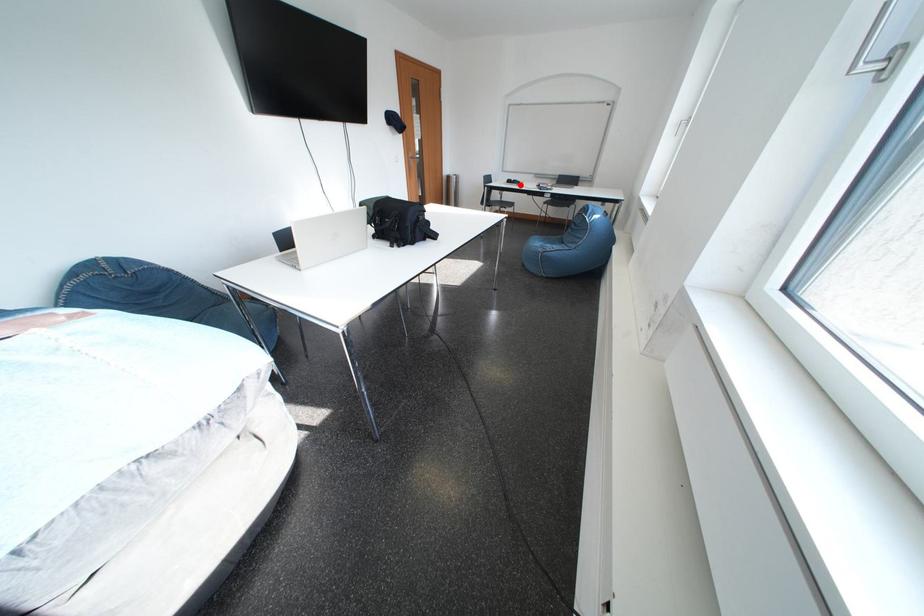
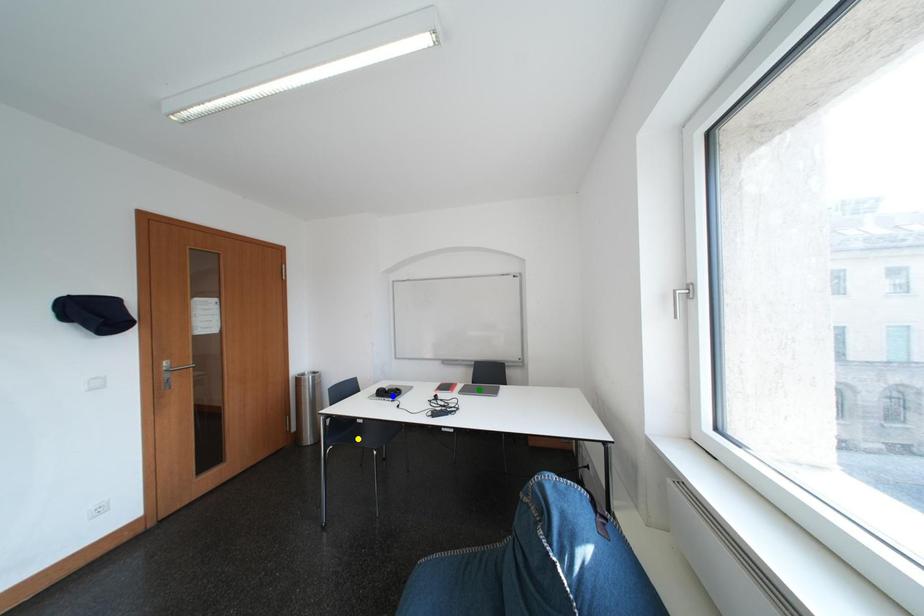
Question: I am providing you with two images of the same scene from different viewpoints. A red point is marked on the first image. You are given multiple points on the second image. Which point in image 2 is actually the same real-world point as the red point in image 1?

Choices:
 (A) blue point
 (B) yellow point
 (C) green point

Answer: (A)